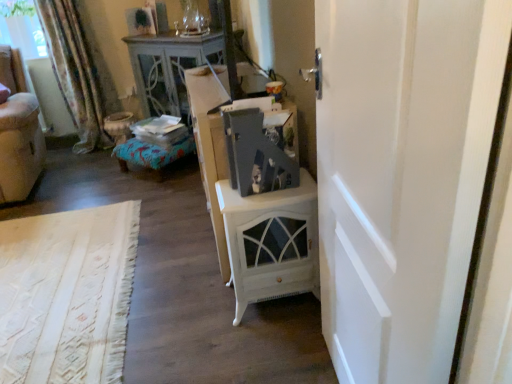
Describe the element at coordinates (210, 145) in the screenshot. I see `white glossy cabinet at center` at that location.

Measure the distance between floral fabric curtain at left and camera.

3.30 meters.

Describe the element at coordinates (271, 242) in the screenshot. The height and width of the screenshot is (384, 512). I see `white painted wood nightstand at center` at that location.

Image resolution: width=512 pixels, height=384 pixels. I want to click on transparent glass window screen at upper left, so click(22, 28).

The height and width of the screenshot is (384, 512). Describe the element at coordinates (22, 28) in the screenshot. I see `transparent glass window screen at upper left` at that location.

Where is `white glossy cabinet at center`? The width and height of the screenshot is (512, 384). white glossy cabinet at center is located at coordinates (210, 145).

Image resolution: width=512 pixels, height=384 pixels. Find the location of `curtain behind the white glossy cabinet at center`. curtain behind the white glossy cabinet at center is located at coordinates (79, 72).

From a real-world perspective, is floral fabric curtain at left above or below white glossy cabinet at center?

From a real-world perspective, floral fabric curtain at left is physically above white glossy cabinet at center.

Is white glossy cabinet at center a part of floral fabric curtain at left?

That's incorrect, white glossy cabinet at center is not inside floral fabric curtain at left.

Is floral fabric curtain at left aimed at white glossy cabinet at center?

Result: No, floral fabric curtain at left is not turned towards white glossy cabinet at center.

Considering the relative positions of velvet beige armchair at left and white glossy cabinet at center in the image provided, is velvet beige armchair at left to the left of white glossy cabinet at center from the viewer's perspective?

Indeed, velvet beige armchair at left is positioned on the left side of white glossy cabinet at center.

Does velvet beige armchair at left have a greater height compared to white glossy cabinet at center?

Yes.

Looking at this image, does velvet beige armchair at left touch white glossy cabinet at center?

No.

Would you say velvet beige armchair at left contains white glossy cabinet at center?

No.

Is white painted wood nightstand at center positioned far away from floral fabric curtain at left?

Yes, white painted wood nightstand at center and floral fabric curtain at left are located far from each other.

Which object is closer to the camera taking this photo, white painted wood nightstand at center or floral fabric curtain at left?

Positioned in front is white painted wood nightstand at center.

From the picture: From a real-world perspective, which is physically below, white painted wood nightstand at center or floral fabric curtain at left?

white painted wood nightstand at center.

Is white painted wood nightstand at center positioned beyond the bounds of floral fabric curtain at left?

Absolutely, white painted wood nightstand at center is external to floral fabric curtain at left.

Considering the sizes of objects velvet beige armchair at left and white painted wood nightstand at center in the image provided, who is thinner, velvet beige armchair at left or white painted wood nightstand at center?

With smaller width is white painted wood nightstand at center.

Is the surface of velvet beige armchair at left in direct contact with white painted wood nightstand at center?

No.

Which object is further away from the camera taking this photo, velvet beige armchair at left or white painted wood nightstand at center?

velvet beige armchair at left is behind.

Looking at this image, from a real-world perspective, which object rests below the other?

In real-world perspective, white painted wood nightstand at center is lower.

Based on the photo, between wooden cabinet at center and white glossy cabinet at center, which one is positioned in front?

white glossy cabinet at center.

Can you confirm if wooden cabinet at center is bigger than white glossy cabinet at center?

No, wooden cabinet at center is not bigger than white glossy cabinet at center.

Is wooden cabinet at center wider or thinner than white glossy cabinet at center?

Clearly, wooden cabinet at center has more width compared to white glossy cabinet at center.

Who is taller, wooden cabinet at center or white glossy cabinet at center?

wooden cabinet at center.

Is white painted wood nightstand at center at the back of floral fabric curtain at left?

No, floral fabric curtain at left is not facing away from white painted wood nightstand at center.

Looking at this image, is floral fabric curtain at left outside of white painted wood nightstand at center?

Yes, floral fabric curtain at left is located beyond the bounds of white painted wood nightstand at center.

Based on the photo, from a real-world perspective, is floral fabric curtain at left physically located above or below white painted wood nightstand at center?

From a real-world perspective, floral fabric curtain at left is physically above white painted wood nightstand at center.

Between floral fabric curtain at left and white painted wood nightstand at center, which one has larger size?

floral fabric curtain at left.

Is point (461, 267) positioned after point (167, 39)?

That is False.

Would you consider white matte door at right to be distant from wooden cabinet at center?

Yes, white matte door at right and wooden cabinet at center are quite far apart.

Find the location of `door below the wooden cabinet at center (from the image's perspective)`. door below the wooden cabinet at center (from the image's perspective) is located at coordinates (402, 175).

At what (x,y) coordinates should I click in order to perform the action: click on dresser below the floral fabric curtain at left (from the image's perspective). Please return your answer as a coordinate pair (x, y). The height and width of the screenshot is (384, 512). Looking at the image, I should click on (210, 145).

This screenshot has height=384, width=512. What are the coordinates of `dresser below the velvet beige armchair at left (from a real-world perspective)` in the screenshot? It's located at (210, 145).

Looking at the image, which one is located further to velvet beige armchair at left, white matte door at right or floral fabric curtain at left?

white matte door at right is positioned further to the anchor velvet beige armchair at left.

From the image, which object appears to be farther from white matte door at right, velvet beige armchair at left or white glossy cabinet at center?

The object further to white matte door at right is velvet beige armchair at left.

When comparing their distances from white glossy cabinet at center, does velvet beige armchair at left or white matte door at right seem further?

velvet beige armchair at left is further to white glossy cabinet at center.

Considering their positions, is wooden cabinet at center positioned closer to floral fabric curtain at left than white glossy cabinet at center?

wooden cabinet at center is closer to floral fabric curtain at left.

Estimate the real-world distances between objects in this image. Which object is closer to white painted wood nightstand at center, wooden cabinet at center or white glossy cabinet at center?

The object closer to white painted wood nightstand at center is white glossy cabinet at center.

When comparing their distances from white matte door at right, does floral fabric curtain at left or wooden cabinet at center seem further?

The object further to white matte door at right is floral fabric curtain at left.

In the scene shown: Looking at the image, which one is located further to white matte door at right, white glossy cabinet at center or wooden cabinet at center?

wooden cabinet at center lies further to white matte door at right than the other object.

Based on their spatial positions, is velvet beige armchair at left or floral fabric curtain at left further from white matte door at right?

Based on the image, floral fabric curtain at left appears to be further to white matte door at right.

Locate an element on the screen. Image resolution: width=512 pixels, height=384 pixels. dresser between white painted wood nightstand at center and wooden cabinet at center along the z-axis is located at coordinates (210, 145).

Image resolution: width=512 pixels, height=384 pixels. What are the coordinates of `furniture between white matte door at right and transparent glass window screen at upper left from front to back` in the screenshot? It's located at (18, 132).

This screenshot has width=512, height=384. Find the location of `curtain positioned between velvet beige armchair at left and transparent glass window screen at upper left from near to far`. curtain positioned between velvet beige armchair at left and transparent glass window screen at upper left from near to far is located at coordinates (79, 72).

You are a GUI agent. You are given a task and a screenshot of the screen. Output one action in this format:
    pyautogui.click(x=<x>, y=<y>)
    Task: Click on the dresser between velvet beige armchair at left and white painted wood nightstand at center in the horizontal direction
    This screenshot has width=512, height=384.
    Given the screenshot: What is the action you would take?
    pyautogui.click(x=210, y=145)